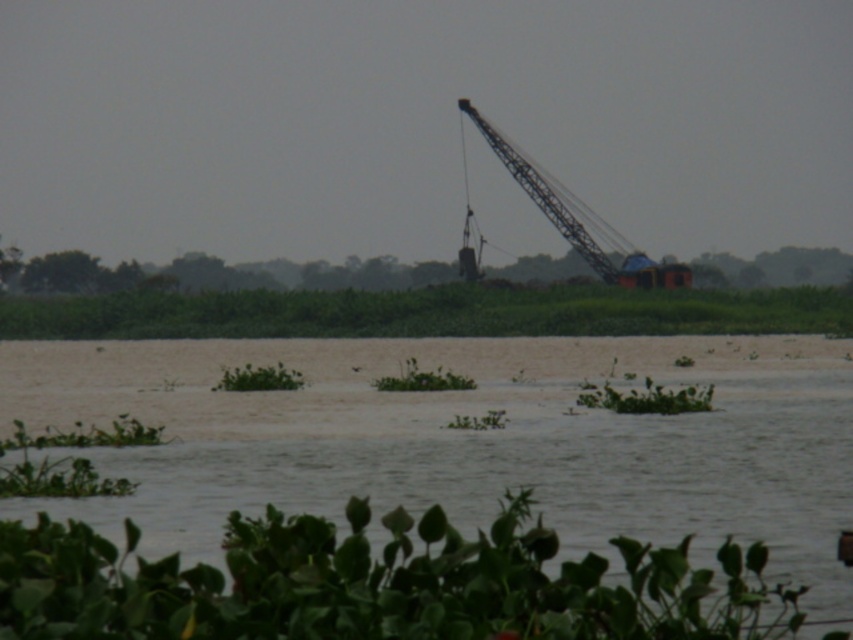
You are a boat operator trying to navigate a narrow waterway between the green leafy plant at lower center and the metallic gray crane at upper center. The boat is 2 meters wide. Can you safely pass through the gap between them?

The green leafy plant at lower center is narrower than the metallic gray crane at upper center, but the exact width of the gap isn t specified. Without knowing the actual distance between them, it s impossible to determine if the 2 meter wide boat can safely pass through.

Looking at this image, you are standing at the edge of the water and see the green leafy plants at center. Based on their position, can you estimate where they are located in the image using coordinates?

The green leafy plants at center are located at coordinates approximately 0.489 on the x axis and 0.504 on the y axis.